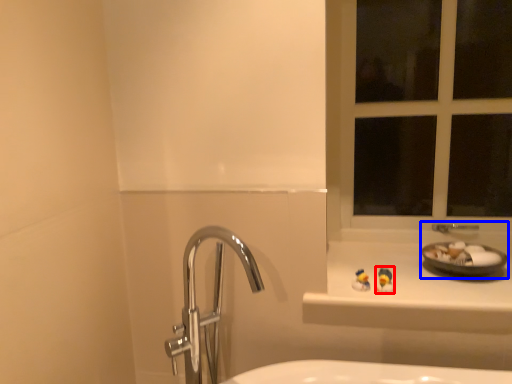
Question: Which of the following is the farthest to the observer, miniature (highlighted by a red box) or sink (highlighted by a blue box)?

Choices:
 (A) miniature
 (B) sink

Answer: (B)